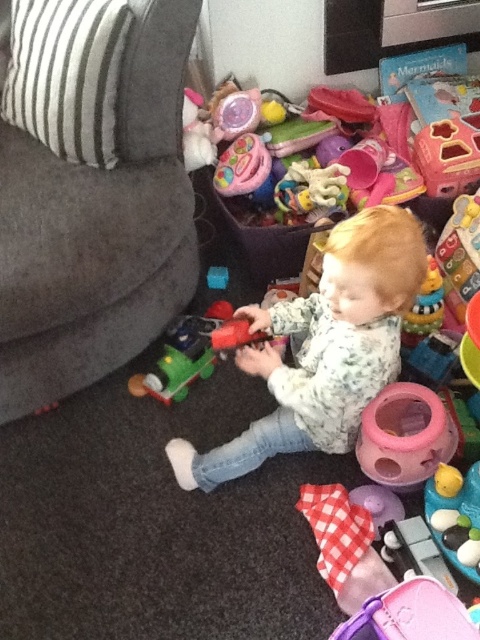
Who is lower down, gray fabric couch at left or matte plastic train at lower left?

matte plastic train at lower left

Does gray fabric couch at left appear under matte plastic train at lower left?

Incorrect, gray fabric couch at left is not positioned below matte plastic train at lower left.

Is point (22, 140) positioned before point (219, 278)?

Yes, point (22, 140) is closer to viewer.

In order to click on gray fabric couch at left in this screenshot , I will do `click(91, 192)`.

What do you see at coordinates (91, 192) in the screenshot? This screenshot has height=640, width=480. I see `gray fabric couch at left` at bounding box center [91, 192].

Does point (124, 346) come behind point (338, 451)?

Yes, point (124, 346) is farther from viewer.

At what (x,y) coordinates should I click in order to perform the action: click on gray fabric couch at left. Please return your answer as a coordinate pair (x, y). Looking at the image, I should click on (91, 192).

Is pink plastic ball at lower right above matte plastic train at lower left?

Incorrect, pink plastic ball at lower right is not positioned above matte plastic train at lower left.

Does pink plastic ball at lower right have a lesser height compared to matte plastic train at lower left?

No.

Which is in front, point (407, 481) or point (224, 285)?

Point (407, 481) is more forward.

This screenshot has width=480, height=640. In order to click on pink plastic ball at lower right in this screenshot , I will do `click(405, 435)`.